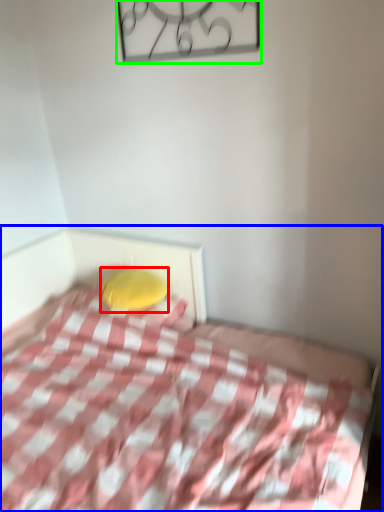
Question: Which object is the closest to the pillow (highlighted by a red box)? Choose among these: bed (highlighted by a blue box) or design (highlighted by a green box).

Choices:
 (A) bed
 (B) design

Answer: (A)